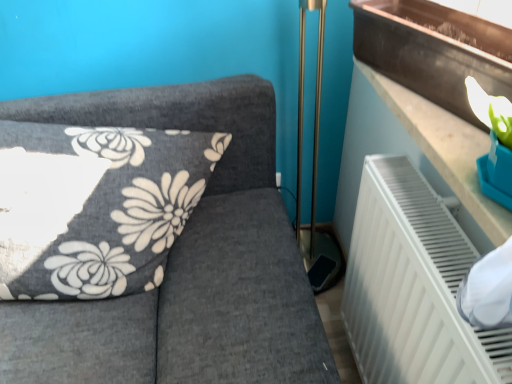
What are the coordinates of `metallic brown window sill at upper right` in the screenshot? It's located at (433, 50).

The width and height of the screenshot is (512, 384). Describe the element at coordinates (433, 50) in the screenshot. I see `metallic brown window sill at upper right` at that location.

The height and width of the screenshot is (384, 512). In order to click on dark gray fabric cushion at upper left in this screenshot , I will do `click(186, 263)`.

What is the approximate width of dark gray fabric cushion at upper left?

It is 19.70 inches.

The image size is (512, 384). Describe the element at coordinates (186, 263) in the screenshot. I see `dark gray fabric cushion at upper left` at that location.

In order to click on metallic brown window sill at upper right in this screenshot , I will do `click(433, 50)`.

Based on their positions, is metallic brown window sill at upper right located to the left or right of dark gray fabric cushion at upper left?

metallic brown window sill at upper right is to the right of dark gray fabric cushion at upper left.

In the image, is metallic brown window sill at upper right positioned in front of or behind dark gray fabric cushion at upper left?

In the image, metallic brown window sill at upper right appears in front of dark gray fabric cushion at upper left.

Which is nearer, (508, 95) or (95, 117)?

Point (508, 95) appears to be closer to the viewer than point (95, 117).

Consider the image. From the image's perspective, is metallic brown window sill at upper right over dark gray fabric cushion at upper left?

Indeed, from the image's perspective, metallic brown window sill at upper right is shown above dark gray fabric cushion at upper left.

From a real-world perspective, is metallic brown window sill at upper right on dark gray fabric cushion at upper left?

Yes, from a real-world perspective, metallic brown window sill at upper right is over dark gray fabric cushion at upper left

Is metallic brown window sill at upper right wider than dark gray fabric cushion at upper left?

No, metallic brown window sill at upper right is not wider than dark gray fabric cushion at upper left.

Consider the image. Who is taller, metallic brown window sill at upper right or dark gray fabric cushion at upper left?

dark gray fabric cushion at upper left.

Looking at the image, does metallic brown window sill at upper right seem bigger or smaller compared to dark gray fabric cushion at upper left?

In the image, metallic brown window sill at upper right appears to be smaller than dark gray fabric cushion at upper left.

Choose the correct answer: Is metallic brown window sill at upper right inside dark gray fabric cushion at upper left or outside it?

The correct answer is: outside.

Is metallic brown window sill at upper right not near dark gray fabric cushion at upper left?

No, metallic brown window sill at upper right is in close proximity to dark gray fabric cushion at upper left.

Is metallic brown window sill at upper right facing away from dark gray fabric cushion at upper left?

That's not correct — metallic brown window sill at upper right is not looking away from dark gray fabric cushion at upper left.

Where is `window sill above the dark gray fabric cushion at upper left (from a real-world perspective)`? The width and height of the screenshot is (512, 384). window sill above the dark gray fabric cushion at upper left (from a real-world perspective) is located at coordinates (433, 50).

Is dark gray fabric cushion at upper left at the right side of metallic brown window sill at upper right?

In fact, dark gray fabric cushion at upper left is to the left of metallic brown window sill at upper right.

Is dark gray fabric cushion at upper left positioned in front of metallic brown window sill at upper right?

No, it is not.

Does point (266, 347) come closer to viewer compared to point (442, 37)?

No, (266, 347) is behind (442, 37).

From the image's perspective, which one is positioned lower, dark gray fabric cushion at upper left or metallic brown window sill at upper right?

From the image's view, dark gray fabric cushion at upper left is below.

From a real-world perspective, which object stands above the other?

From a 3D spatial view, metallic brown window sill at upper right is above.

In the scene shown: Considering the sizes of objects dark gray fabric cushion at upper left and metallic brown window sill at upper right in the image provided, who is wider, dark gray fabric cushion at upper left or metallic brown window sill at upper right?

Wider between the two is dark gray fabric cushion at upper left.

Is dark gray fabric cushion at upper left shorter than metallic brown window sill at upper right?

No, dark gray fabric cushion at upper left is not shorter than metallic brown window sill at upper right.

Does dark gray fabric cushion at upper left have a smaller size compared to metallic brown window sill at upper right?

Incorrect, dark gray fabric cushion at upper left is not smaller in size than metallic brown window sill at upper right.

Is dark gray fabric cushion at upper left spatially inside metallic brown window sill at upper right, or outside of it?

The correct answer is: outside.

Is dark gray fabric cushion at upper left touching metallic brown window sill at upper right?

There is a gap between dark gray fabric cushion at upper left and metallic brown window sill at upper right.

Is metallic brown window sill at upper right at the back of dark gray fabric cushion at upper left?

That's not correct — dark gray fabric cushion at upper left is not looking away from metallic brown window sill at upper right.

What's the angular difference between dark gray fabric cushion at upper left and metallic brown window sill at upper right's facing directions?

The angular difference between dark gray fabric cushion at upper left and metallic brown window sill at upper right is 70.1 degrees.

The width and height of the screenshot is (512, 384). Find the location of `furniture located behind the metallic brown window sill at upper right`. furniture located behind the metallic brown window sill at upper right is located at coordinates (186, 263).

Find the location of `furniture on the left of metallic brown window sill at upper right`. furniture on the left of metallic brown window sill at upper right is located at coordinates (186, 263).

Where is `window sill that appears above the dark gray fabric cushion at upper left (from a real-world perspective)`? The height and width of the screenshot is (384, 512). window sill that appears above the dark gray fabric cushion at upper left (from a real-world perspective) is located at coordinates (433, 50).